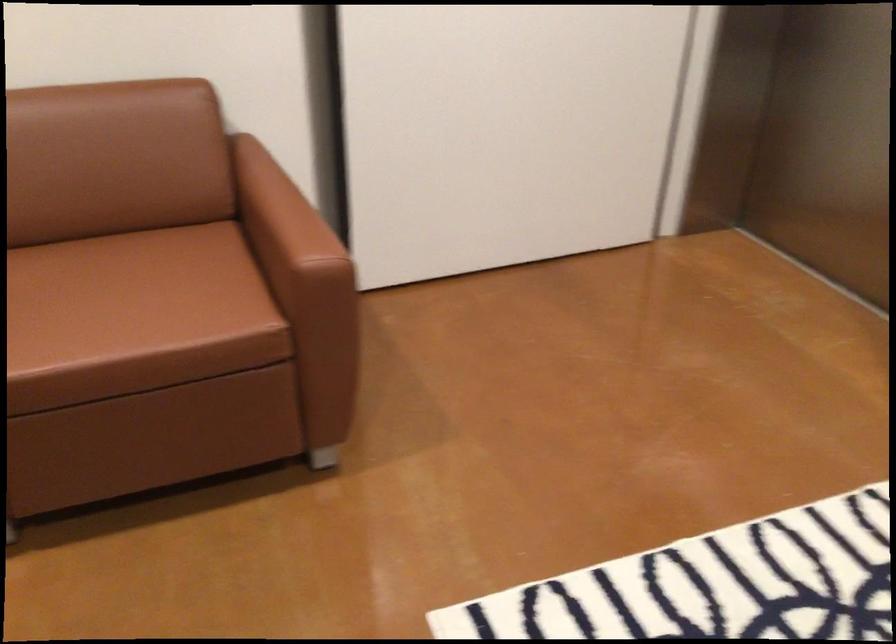
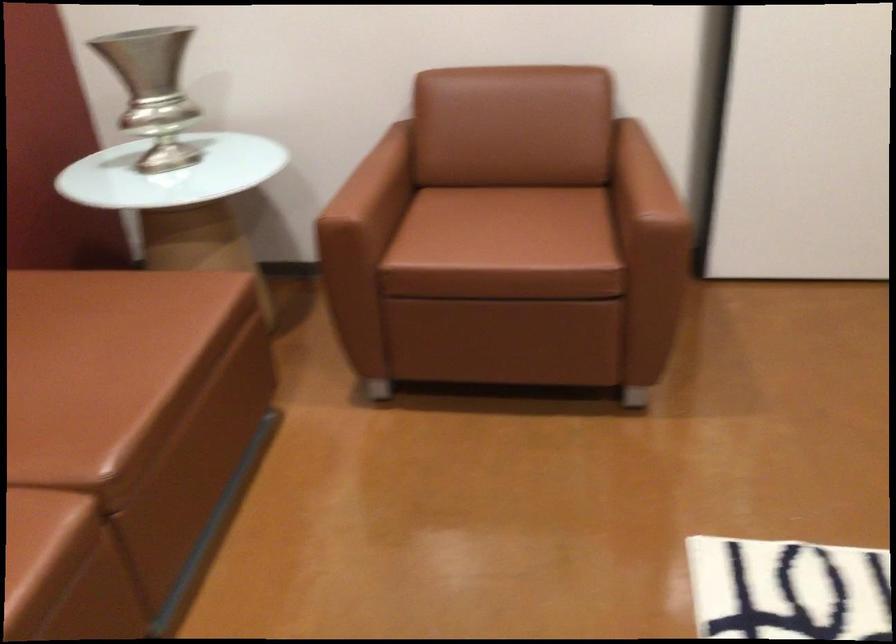
Locate, in the second image, the point that corresponds to point (283, 219) in the first image.

(643, 180)